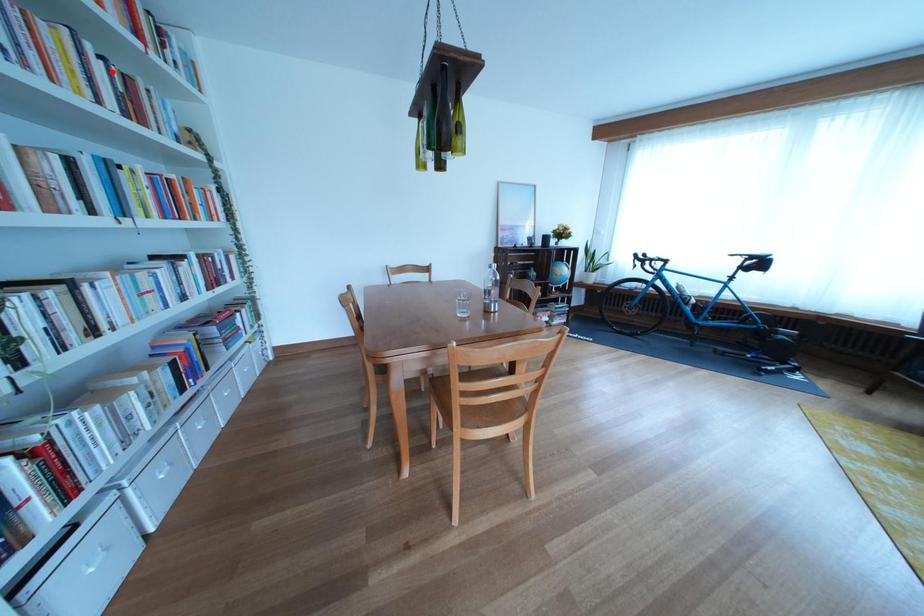
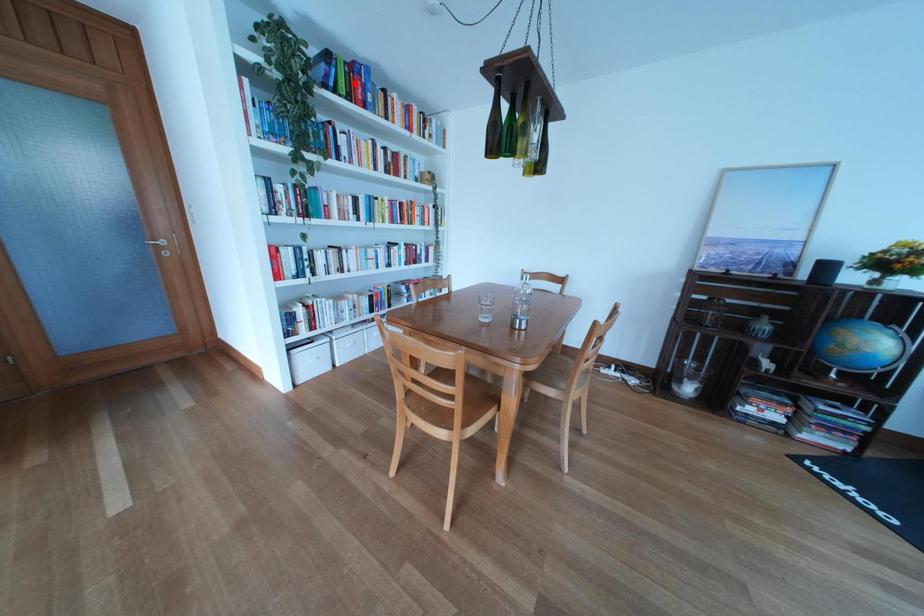
I am providing you with two images of the same scene from different viewpoints. A red point is marked on the first image and another point is marked on the second image. Is the marked point in image1 the same physical position as the marked point in image2?

No